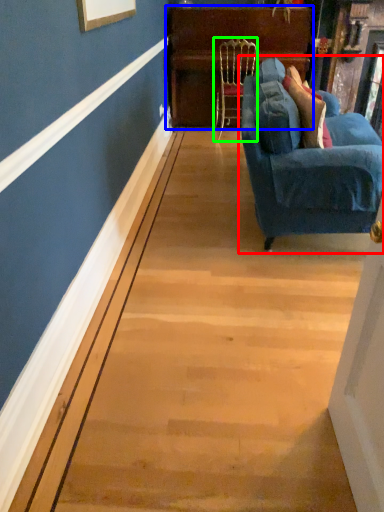
Question: Estimate the real-world distances between objects in this image. Which object is farther from studio couch (highlighted by a red box), dresser (highlighted by a blue box) or chair (highlighted by a green box)?

Choices:
 (A) dresser
 (B) chair

Answer: (A)